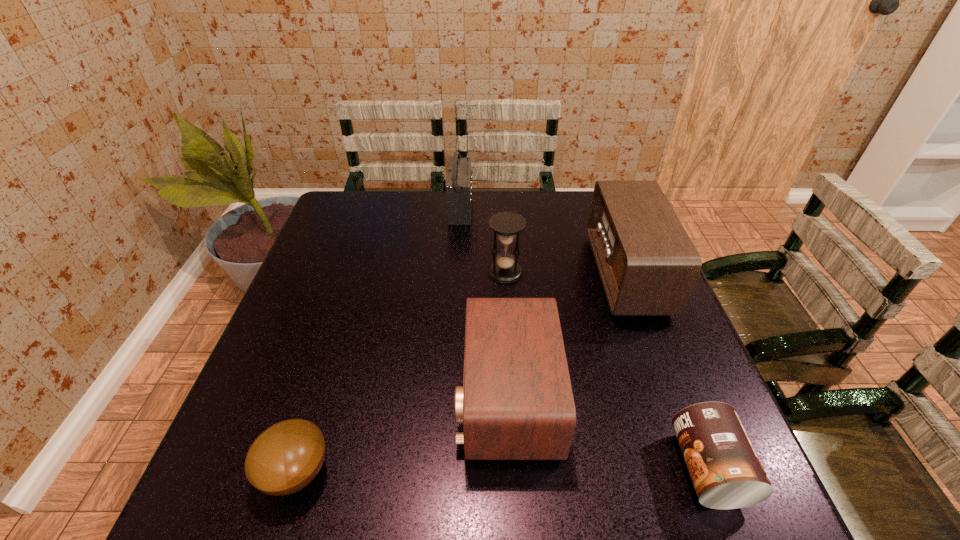
This screenshot has height=540, width=960. Find the location of `free spot located on the front-facing side of the fifth shortest object`. free spot located on the front-facing side of the fifth shortest object is located at coordinates (479, 274).

The image size is (960, 540). In order to click on vacant space situated 0.050m on the front-facing side of the fifth shortest object in this screenshot , I will do `click(579, 274)`.

You are a GUI agent. You are given a task and a screenshot of the screen. Output one action in this format:
    pyautogui.click(x=<x>, y=<y>)
    Task: Click on the free spot located on the front-facing side of the fifth shortest object
    Image resolution: width=960 pixels, height=540 pixels.
    Given the screenshot: What is the action you would take?
    pyautogui.click(x=535, y=274)

Find the location of `vacant space located 0.300m on the back of the hourglass`. vacant space located 0.300m on the back of the hourglass is located at coordinates (500, 203).

Locate an element on the screen. vacant space located on the front panel of the nearest radio receiver is located at coordinates (304, 397).

In order to click on vacant space located 0.330m on the front panel of the nearest radio receiver in this screenshot , I will do `click(300, 397)`.

At what (x,y) coordinates should I click in order to perform the action: click on vacant space located 0.190m on the front panel of the nearest radio receiver. Please return your answer as a coordinate pair (x, y). This screenshot has height=540, width=960. Looking at the image, I should click on (367, 397).

Where is `free space located on the front label of the can`? The height and width of the screenshot is (540, 960). free space located on the front label of the can is located at coordinates (567, 468).

Where is `free region located 0.050m on the front label of the can`? free region located 0.050m on the front label of the can is located at coordinates (649, 468).

You are a GUI agent. You are given a task and a screenshot of the screen. Output one action in this format:
    pyautogui.click(x=<x>, y=<y>)
    Task: Click on the vacant space located 0.240m on the front label of the can
    
    Given the screenshot: What is the action you would take?
    pyautogui.click(x=545, y=468)